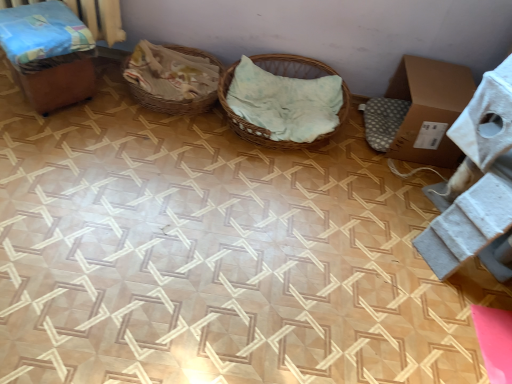
Where is `vacant region in front of wooden box at left`? The image size is (512, 384). vacant region in front of wooden box at left is located at coordinates (41, 140).